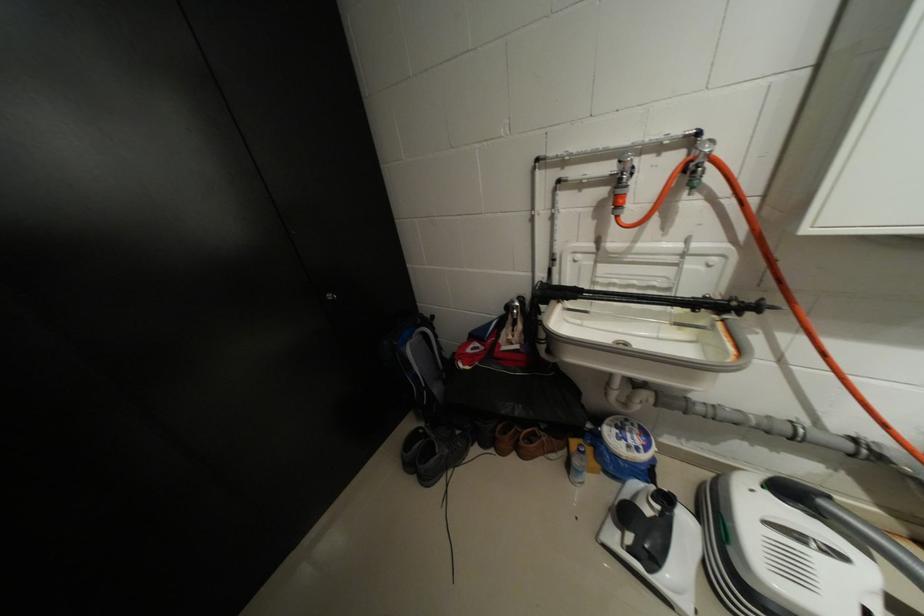
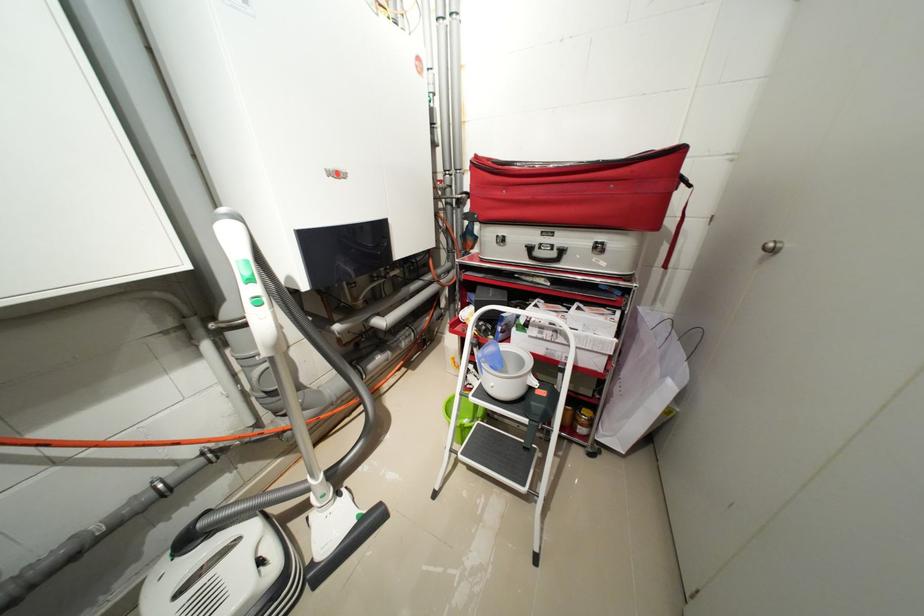
Based on the continuous images, in which direction is the camera rotating?

The rotation direction of the camera is right-down.